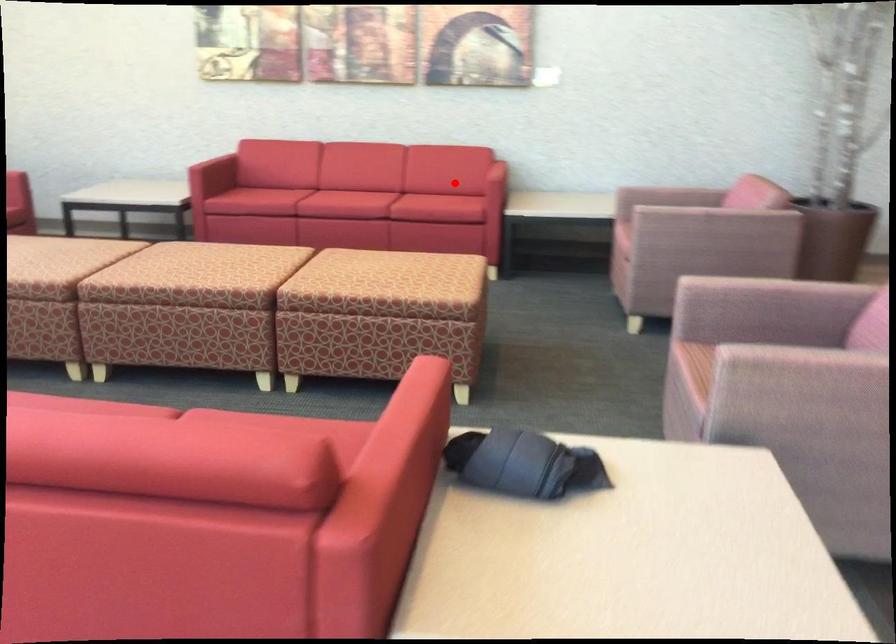
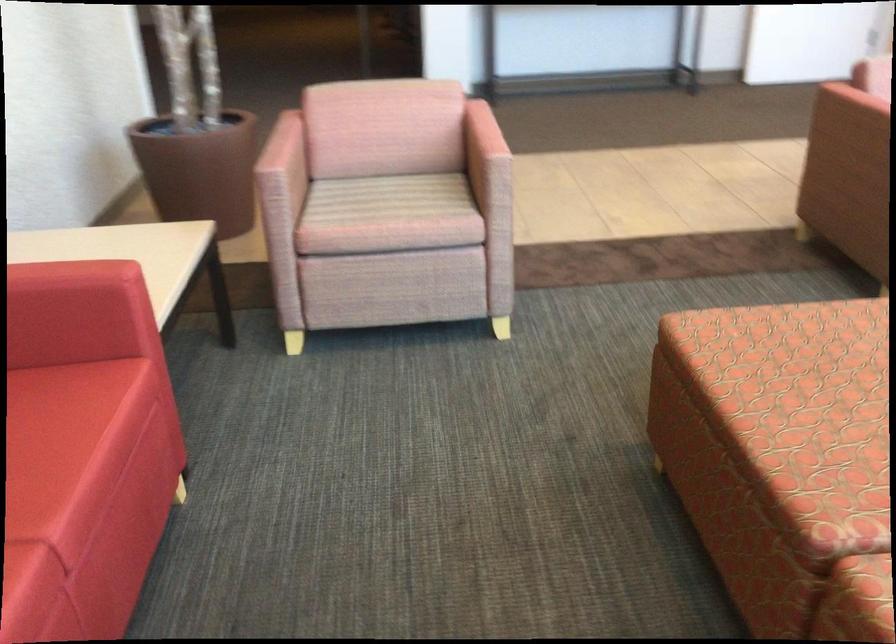
Question: I am providing you with two images of the same scene from different viewpoints. A red point is shown in image1. For the corresponding object point in image2, is it positioned nearer or farther from the camera?

Choices:
 (A) Nearer
 (B) Farther

Answer: (A)